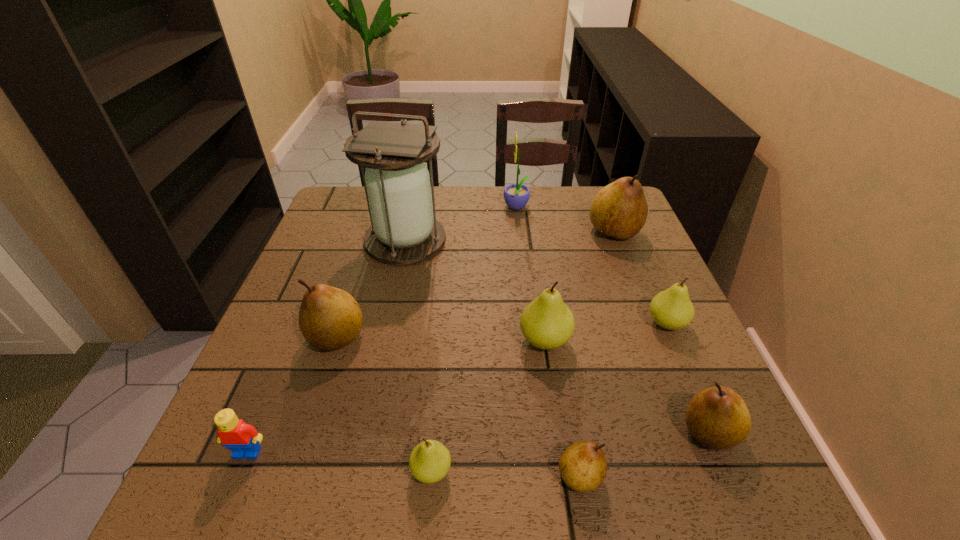
In order to click on lantern in this screenshot , I will do `click(397, 184)`.

You are a GUI agent. You are given a task and a screenshot of the screen. Output one action in this format:
    pyautogui.click(x=<x>, y=<y>)
    Task: Click on the sunflower
    This screenshot has height=540, width=960.
    Given the screenshot: What is the action you would take?
    pyautogui.click(x=516, y=196)

You are a GUI agent. You are given a task and a screenshot of the screen. Output one action in this format:
    pyautogui.click(x=<x>, y=<y>)
    Task: Click on the tallest pear
    The image size is (960, 540).
    Given the screenshot: What is the action you would take?
    pyautogui.click(x=619, y=210)

The width and height of the screenshot is (960, 540). Identify the location of the farthest pear. (619, 210).

The height and width of the screenshot is (540, 960). In order to click on the second biggest brown pear in this screenshot , I will do `click(330, 318)`.

Identify the location of the leftmost brown pear. [330, 318].

Locate an element on the screen. the biggest green pear is located at coordinates (547, 323).

Find the location of a particular element. This screenshot has height=540, width=960. the second smallest green pear is located at coordinates [x=672, y=309].

You are a GUI agent. You are given a task and a screenshot of the screen. Output one action in this format:
    pyautogui.click(x=<x>, y=<y>)
    Task: Click on the second smallest brown pear
    Image resolution: width=960 pixels, height=540 pixels.
    Given the screenshot: What is the action you would take?
    pyautogui.click(x=718, y=418)

Where is `Lego`? Image resolution: width=960 pixels, height=540 pixels. Lego is located at coordinates (243, 439).